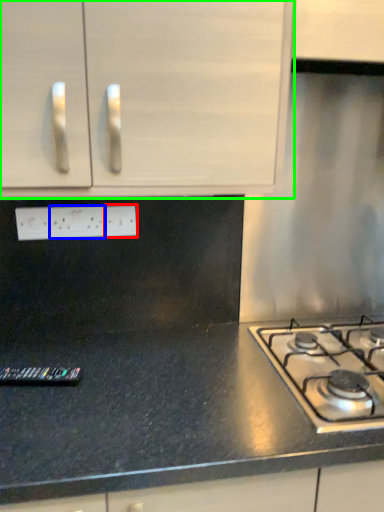
Question: Based on their relative distances, which object is nearer to electric outlet (highlighted by a red box)? Choose from electric outlet (highlighted by a blue box) and cabinetry (highlighted by a green box).

Choices:
 (A) electric outlet
 (B) cabinetry

Answer: (A)